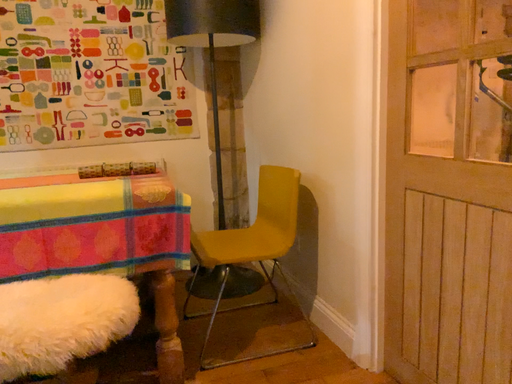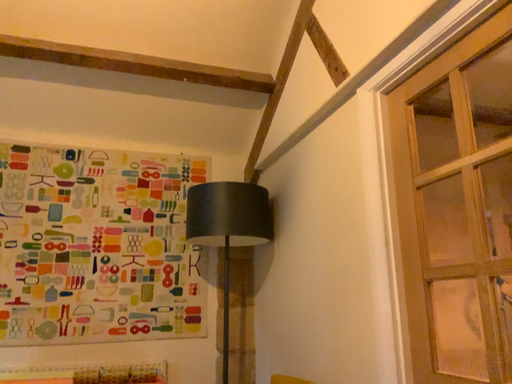
Question: Which way did the camera rotate in the video?

Choices:
 (A) rotated upward
 (B) rotated downward

Answer: (A)